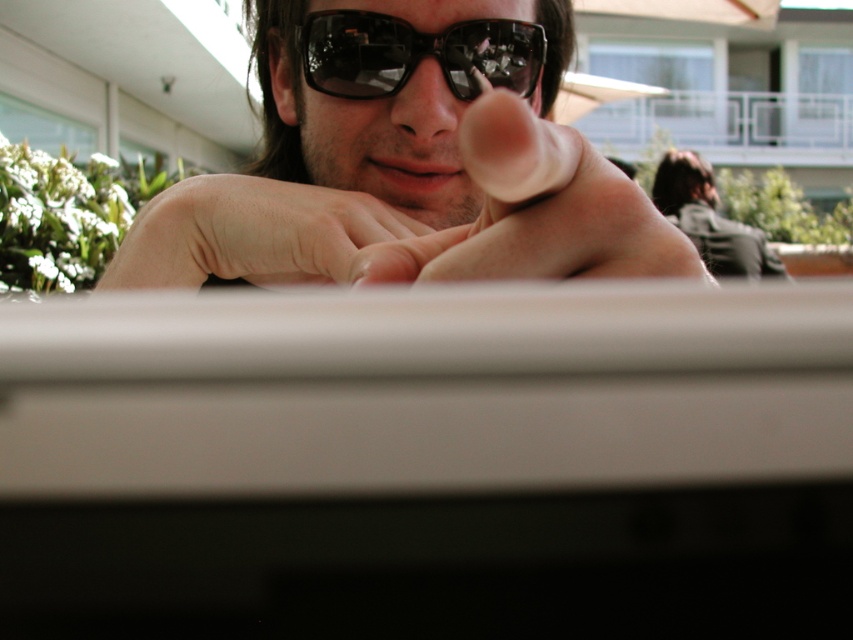
Can you confirm if skinny flesh at center is shorter than black reflective sunglasses at center?

No.

This screenshot has height=640, width=853. Describe the element at coordinates (535, 212) in the screenshot. I see `skinny flesh at center` at that location.

Which is in front, point (521, 266) or point (318, 36)?

Point (521, 266) is in front.

Image resolution: width=853 pixels, height=640 pixels. I want to click on skinny flesh at center, so click(535, 212).

You are a GUI agent. You are given a task and a screenshot of the screen. Output one action in this format:
    pyautogui.click(x=<x>, y=<y>)
    Task: Click on the matte black sunglasses at center
    
    Given the screenshot: What is the action you would take?
    pyautogui.click(x=405, y=161)

From the picture: Does matte black sunglasses at center appear over black reflective sunglasses at center?

Incorrect, matte black sunglasses at center is not positioned above black reflective sunglasses at center.

Is point (316, 180) positioned after point (410, 74)?

Yes.

Find the location of a particular element. The width and height of the screenshot is (853, 640). matte black sunglasses at center is located at coordinates (405, 161).

Between skinny white hand at center and black reflective sunglasses at center, which one has less height?

With less height is black reflective sunglasses at center.

Is skinny white hand at center wider than black reflective sunglasses at center?

Yes, skinny white hand at center is wider than black reflective sunglasses at center.

The width and height of the screenshot is (853, 640). Identify the location of skinny white hand at center. (250, 234).

Image resolution: width=853 pixels, height=640 pixels. I want to click on skinny white hand at center, so (250, 234).